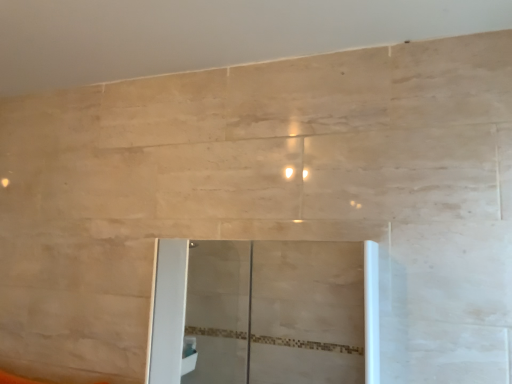
In order to click on transparent glass door at center in this screenshot , I will do `click(265, 312)`.

What do you see at coordinates (265, 312) in the screenshot? The image size is (512, 384). I see `transparent glass door at center` at bounding box center [265, 312].

Image resolution: width=512 pixels, height=384 pixels. In order to click on transparent glass door at center in this screenshot , I will do `click(265, 312)`.